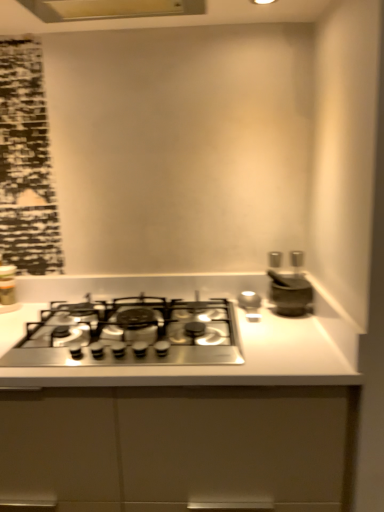
Question: Is satin silver mortar at right not within stainless steel gas stove at center?

Choices:
 (A) no
 (B) yes

Answer: (B)

Question: From a real-world perspective, is satin silver mortar at right positioned under stainless steel gas stove at center based on gravity?

Choices:
 (A) yes
 (B) no

Answer: (B)

Question: Is there a large distance between satin silver mortar at right and stainless steel gas stove at center?

Choices:
 (A) no
 (B) yes

Answer: (A)

Question: Considering the relative sizes of satin silver mortar at right and stainless steel gas stove at center in the image provided, is satin silver mortar at right taller than stainless steel gas stove at center?

Choices:
 (A) yes
 (B) no

Answer: (A)

Question: Is the surface of satin silver mortar at right in direct contact with stainless steel gas stove at center?

Choices:
 (A) yes
 (B) no

Answer: (B)

Question: Considering their positions, is satin silver mortar at right located in front of or behind stainless steel gas stove at center?

Choices:
 (A) front
 (B) behind

Answer: (B)

Question: Do you think satin silver mortar at right is within stainless steel gas stove at center, or outside of it?

Choices:
 (A) outside
 (B) inside

Answer: (A)

Question: In terms of width, does satin silver mortar at right look wider or thinner when compared to stainless steel gas stove at center?

Choices:
 (A) wide
 (B) thin

Answer: (B)

Question: From a real-world perspective, relative to stainless steel gas stove at center, is satin silver mortar at right vertically above or below?

Choices:
 (A) above
 (B) below

Answer: (A)

Question: Considering the positions of metallic silver canister at left and matte white exhaust hood at upper center in the image, is metallic silver canister at left taller or shorter than matte white exhaust hood at upper center?

Choices:
 (A) tall
 (B) short

Answer: (A)

Question: In the image, is metallic silver canister at left positioned in front of or behind matte white exhaust hood at upper center?

Choices:
 (A) behind
 (B) front

Answer: (A)

Question: Looking at the image, does metallic silver canister at left seem bigger or smaller compared to matte white exhaust hood at upper center?

Choices:
 (A) big
 (B) small

Answer: (B)

Question: Is metallic silver canister at left inside or outside of matte white exhaust hood at upper center?

Choices:
 (A) inside
 (B) outside

Answer: (B)

Question: Considering the positions of point (23, 342) and point (3, 298), is point (23, 342) closer or farther from the camera than point (3, 298)?

Choices:
 (A) closer
 (B) farther

Answer: (A)

Question: From the image's perspective, is stainless steel gas stove at center above or below metallic silver canister at left?

Choices:
 (A) below
 (B) above

Answer: (A)